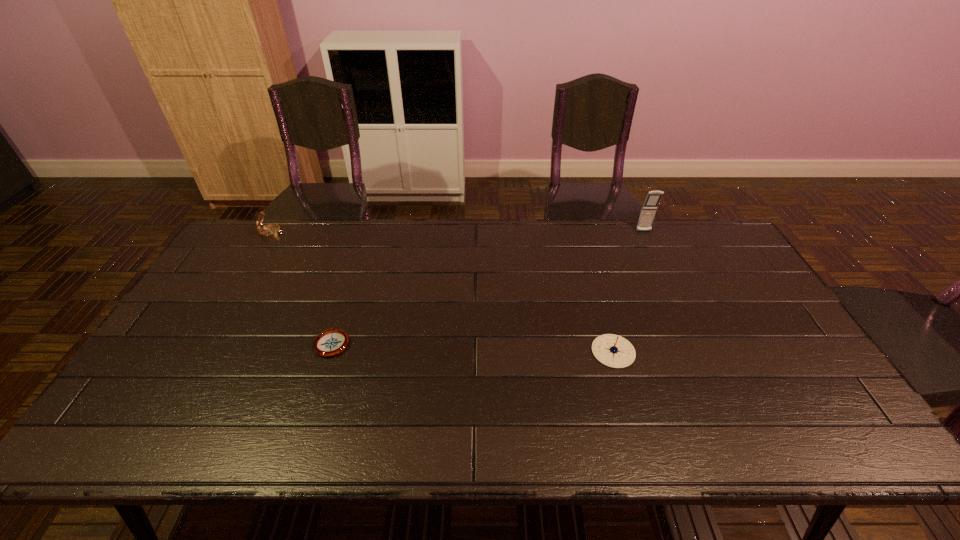
At what (x,y) coordinates should I click in order to perform the action: click on free region at the far left corner of the desktop. Please return your answer as a coordinate pair (x, y). Looking at the image, I should click on (272, 249).

Image resolution: width=960 pixels, height=540 pixels. In order to click on free space between the second object from right to left and the cellular telephone in this screenshot , I will do 629,292.

Identify the location of free spot between the cellular telephone and the second object from right to left. The height and width of the screenshot is (540, 960). (629, 292).

Where is `free spot between the second object from right to left and the tallest object`? The width and height of the screenshot is (960, 540). free spot between the second object from right to left and the tallest object is located at coordinates (629, 292).

The height and width of the screenshot is (540, 960). Find the location of `vacant area that lies between the second compass from left to right and the second object from right to left`. vacant area that lies between the second compass from left to right and the second object from right to left is located at coordinates (473, 347).

The height and width of the screenshot is (540, 960). I want to click on free space that is in between the leftmost object and the second compass from left to right, so click(x=302, y=288).

You are a GUI agent. You are given a task and a screenshot of the screen. Output one action in this format:
    pyautogui.click(x=<x>, y=<y>)
    Task: Click on the vacant area that lies between the cellular telephone and the third object from right to left
    The image size is (960, 540).
    Given the screenshot: What is the action you would take?
    pyautogui.click(x=488, y=287)

At what (x,y) coordinates should I click in order to perform the action: click on vacant space that is in between the shortest compass and the second shortest compass. Please return your answer as a coordinate pair (x, y). The height and width of the screenshot is (540, 960). Looking at the image, I should click on (473, 347).

Identify the location of free spot between the tallest compass and the second compass from left to right. (302, 288).

This screenshot has height=540, width=960. Find the location of `vacant area that lies between the rightmost compass and the third object from right to left`. vacant area that lies between the rightmost compass and the third object from right to left is located at coordinates (473, 347).